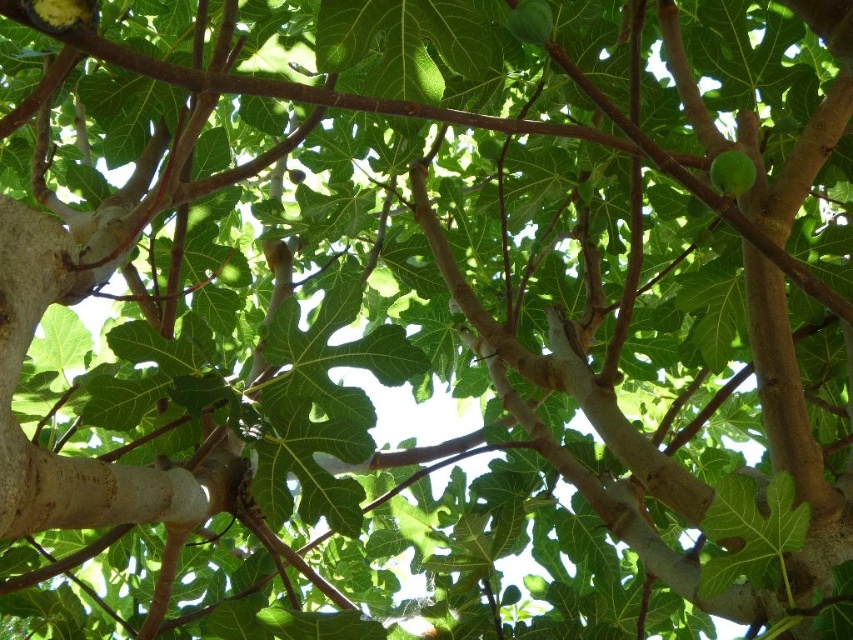
From the picture: You are standing at the camera position and want to touch the point at coordinates point (711,180) on the fig tree. If your arm can reach 36 inches, will you be able to reach it?

The point (711,180) is 37.00 inches away from the camera, which is beyond your arm reach of 36 inches. You cannot reach it.

You are looking at the fig tree and notice two points marked on the image. The first point is at coordinates point (x=45, y=13) and the second is at point (x=749, y=186). Which of these points is nearer to your eyes?

Point (x=45, y=13) is closer to the camera than point (x=749, y=186), so the first point is nearer to your eyes.